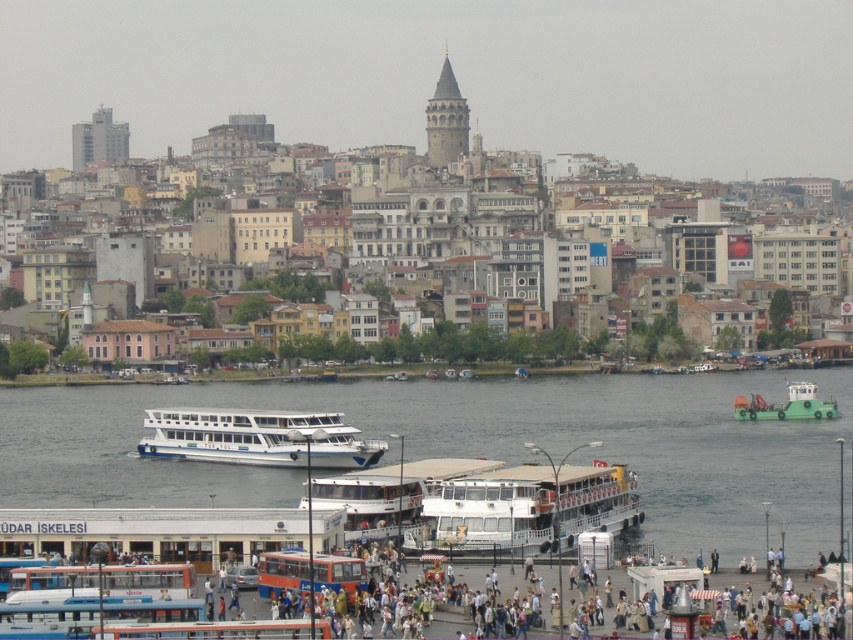
Question: Which of the following is the farthest from the observer?

Choices:
 (A) blue water at center
 (B) white matte ferry at center

Answer: (A)

Question: Estimate the real-world distances between objects in this image. Which object is farther from the green matte tugboat at lower right?

Choices:
 (A) blue water at center
 (B) white matte ferry at center

Answer: (B)

Question: Is blue water at center positioned before white matte boat at center?

Choices:
 (A) yes
 (B) no

Answer: (A)

Question: Which point is closer to the camera taking this photo?

Choices:
 (A) (723, 545)
 (B) (521, 481)
 (C) (250, 454)

Answer: (A)

Question: Can you confirm if white matte ferry at center is positioned to the right of green matte tugboat at lower right?

Choices:
 (A) no
 (B) yes

Answer: (A)

Question: Is white matte ferry at center positioned at the back of white matte boat at center?

Choices:
 (A) yes
 (B) no

Answer: (B)